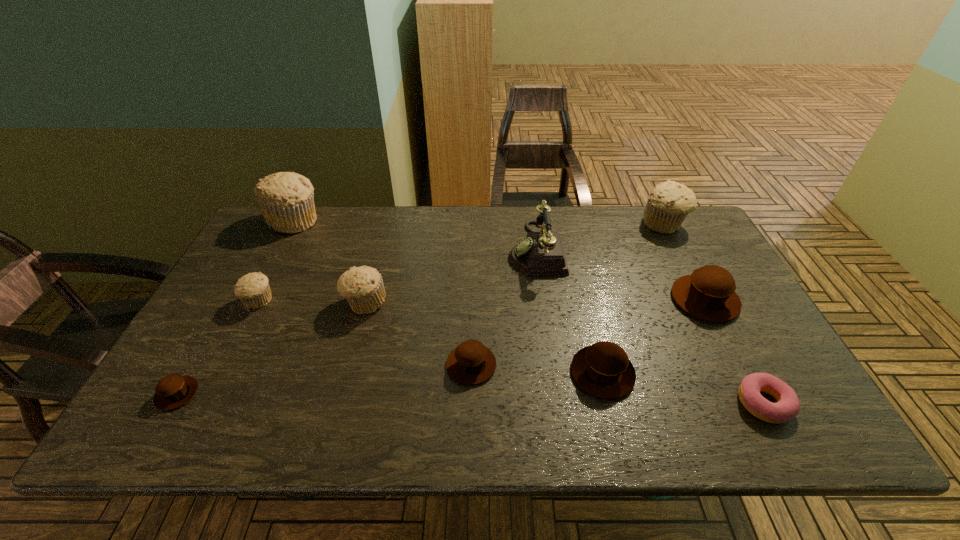
This screenshot has height=540, width=960. In order to click on the biggest beige muffin in this screenshot , I will do `click(286, 199)`.

The width and height of the screenshot is (960, 540). In order to click on telephone in this screenshot , I will do `click(542, 253)`.

Find the location of a particular element. the second biggest beige muffin is located at coordinates (668, 204).

Locate an element on the screen. The image size is (960, 540). the rightmost beige muffin is located at coordinates (668, 204).

Locate an element on the screen. The image size is (960, 540). the fourth muffin from left to right is located at coordinates (363, 287).

Image resolution: width=960 pixels, height=540 pixels. I want to click on the seventh object from right to left, so click(x=363, y=287).

Locate an element on the screen. the biggest brown muffin is located at coordinates (708, 293).

Where is `the rightmost brown muffin`? Image resolution: width=960 pixels, height=540 pixels. the rightmost brown muffin is located at coordinates (708, 293).

The image size is (960, 540). I want to click on the smallest beige muffin, so click(x=253, y=289).

The height and width of the screenshot is (540, 960). What are the coordinates of `the third smallest brown muffin` in the screenshot? It's located at (603, 369).